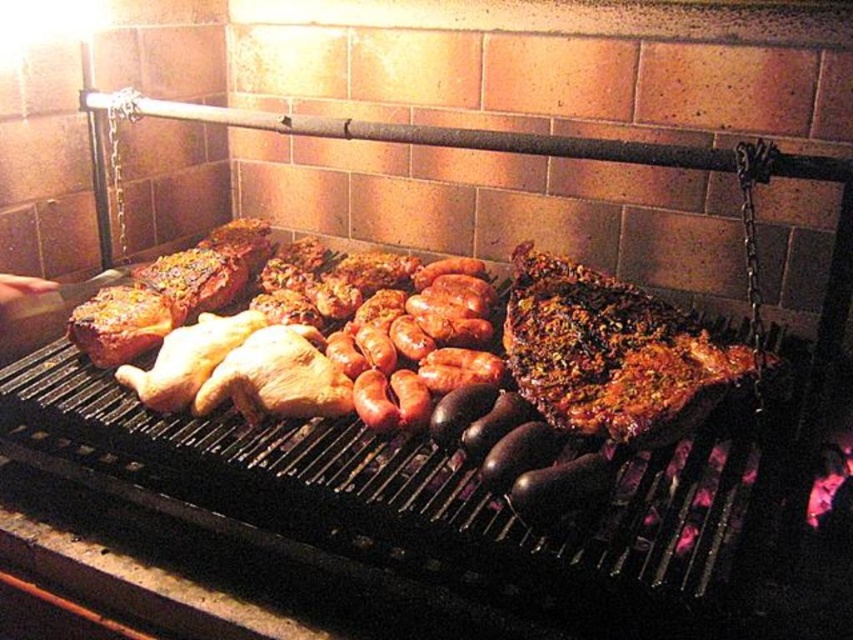
Question: Does shiny brown steak at right appear on the right side of golden brown skin at center?

Choices:
 (A) yes
 (B) no

Answer: (A)

Question: From the image, what is the correct spatial relationship of shiny brown steak at right in relation to golden brown skin at center?

Choices:
 (A) right
 (B) left

Answer: (A)

Question: Which point is closer to the camera taking this photo?

Choices:
 (A) (523, 291)
 (B) (428, 301)
 (C) (300, 339)

Answer: (C)

Question: Which of the following is the farthest from the observer?

Choices:
 (A) smooth brown sausages at center
 (B) shiny brown steak at right
 (C) golden brown skin at center

Answer: (C)

Question: Considering the relative positions of shiny brown steak at right and golden brown skin at center in the image provided, where is shiny brown steak at right located with respect to golden brown skin at center?

Choices:
 (A) right
 (B) left

Answer: (A)

Question: Which point is farther from the camera taking this photo?

Choices:
 (A) (386, 324)
 (B) (560, 282)

Answer: (A)